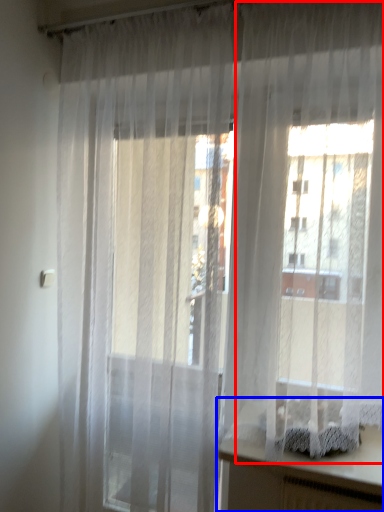
Question: Which point is closer to the camera, curtain (highlighted by a red box) or vanity (highlighted by a blue box)?

Choices:
 (A) curtain
 (B) vanity

Answer: (A)